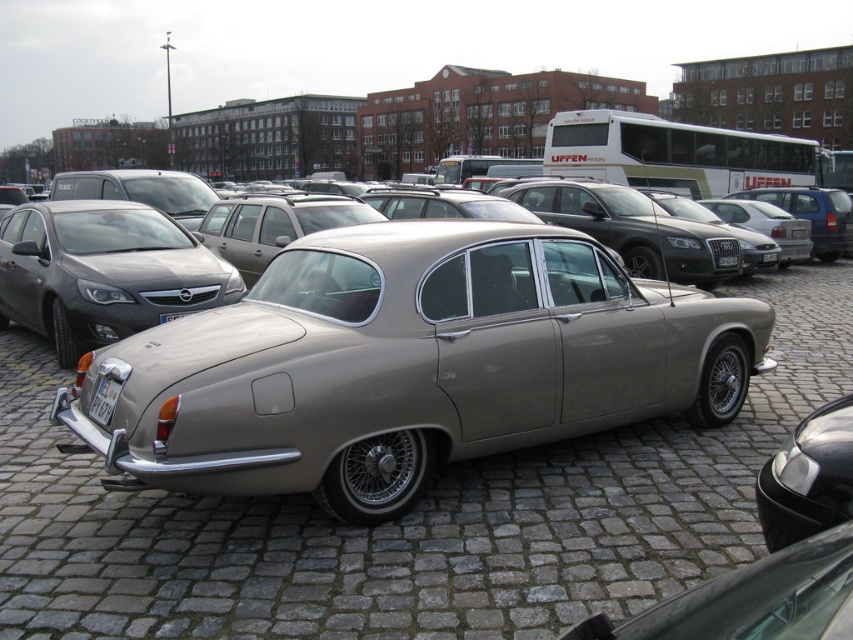
Question: Which of the following is the closest to the observer?

Choices:
 (A) satin silver car at left
 (B) white plastic license plate at lower left
 (C) satin silver car at center

Answer: (C)

Question: Is metallic silver car at center closer to camera compared to satin silver car at left?

Choices:
 (A) no
 (B) yes

Answer: (B)

Question: Can you confirm if metallic silver car at center is wider than white plastic license plate at lower left?

Choices:
 (A) yes
 (B) no

Answer: (A)

Question: Among these objects, which one is nearest to the camera?

Choices:
 (A) satin silver car at left
 (B) white plastic license plate at lower left

Answer: (B)

Question: Does metallic silver car at center lie in front of white plastic license plate at center?

Choices:
 (A) yes
 (B) no

Answer: (A)

Question: Which object is closer to the camera taking this photo?

Choices:
 (A) white plastic license plate at center
 (B) satin silver car at left
 (C) white plastic license plate at lower left
 (D) metallic silver car at center

Answer: (D)